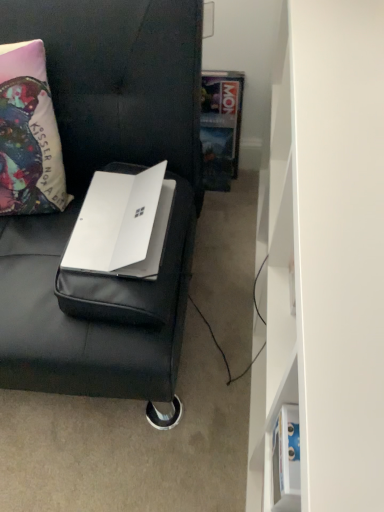
The height and width of the screenshot is (512, 384). Identify the location of free space in front of hardcover book at center. (226, 202).